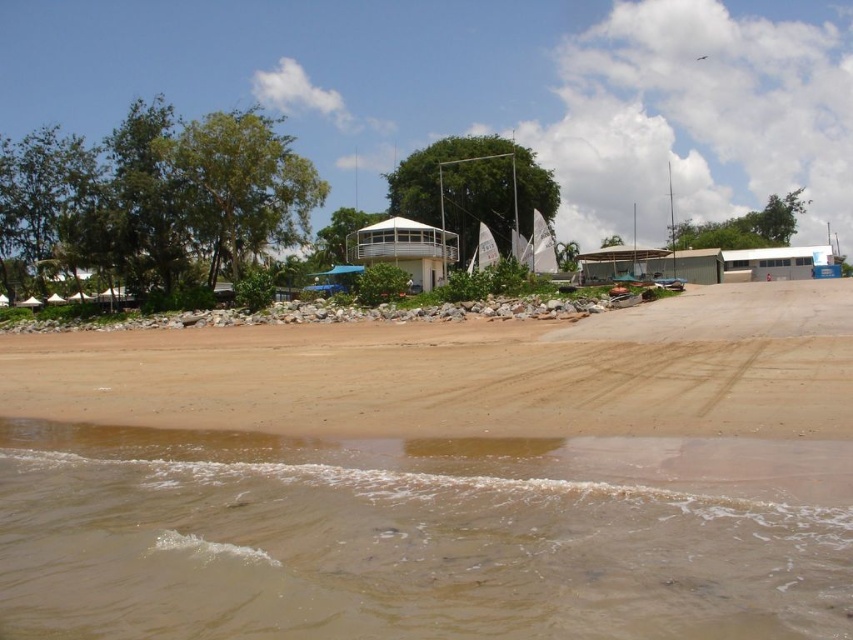
Question: Which object is farther from the camera taking this photo?

Choices:
 (A) brown sandy water at lower left
 (B) brown sand at lower center

Answer: (B)

Question: Can you confirm if brown sandy water at lower left is smaller than brown sand at lower center?

Choices:
 (A) no
 (B) yes

Answer: (B)

Question: Which point is farther to the camera?

Choices:
 (A) (747, 356)
 (B) (556, 531)

Answer: (A)

Question: Can you confirm if brown sandy water at lower left is thinner than brown sand at lower center?

Choices:
 (A) yes
 (B) no

Answer: (A)

Question: Can you confirm if brown sandy water at lower left is positioned below brown sand at lower center?

Choices:
 (A) no
 (B) yes

Answer: (B)

Question: Which point is closer to the camera?

Choices:
 (A) brown sandy water at lower left
 (B) brown sand at lower center

Answer: (A)